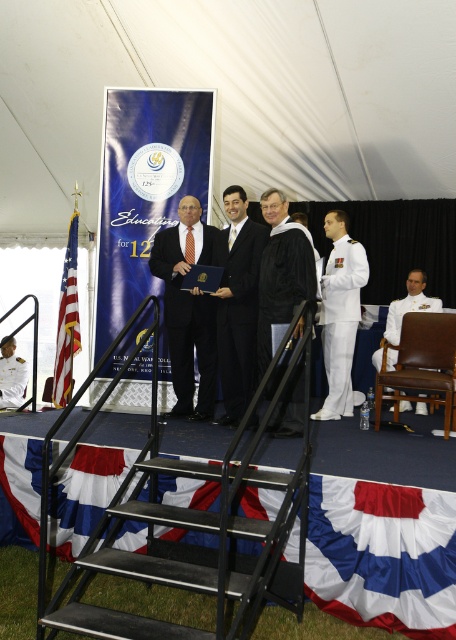
Question: Which point is farther from the camera taking this photo?

Choices:
 (A) (285, 410)
 (B) (15, 385)
 (C) (211, 323)
 (D) (207, 467)

Answer: (B)

Question: Considering the real-world distances, which object is farthest from the black suit at center?

Choices:
 (A) black matte graduation gown at center
 (B) white uniform at right
 (C) white uniform at center
 (D) matte black suit at center

Answer: (C)

Question: From the image, what is the correct spatial relationship of matte black suit at center in relation to white uniform at center?

Choices:
 (A) below
 (B) above

Answer: (B)

Question: Can you confirm if matte black suit at center is positioned to the left of white uniform at center?

Choices:
 (A) yes
 (B) no

Answer: (B)

Question: Which point is farther from the camera taking this photo?

Choices:
 (A) (72, 563)
 (B) (0, 381)
 (C) (68, 273)
 (D) (309, 291)

Answer: (B)

Question: Does black matte graduation gown at center have a lesser width compared to red fabric flag at left?

Choices:
 (A) yes
 (B) no

Answer: (B)